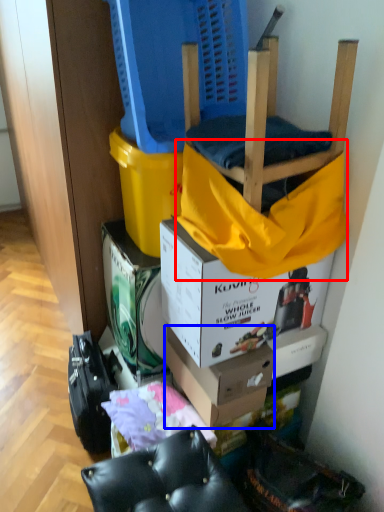
Question: Which object is closer to the camera taking this photo, blanket (highlighted by a red box) or box (highlighted by a blue box)?

Choices:
 (A) blanket
 (B) box

Answer: (A)